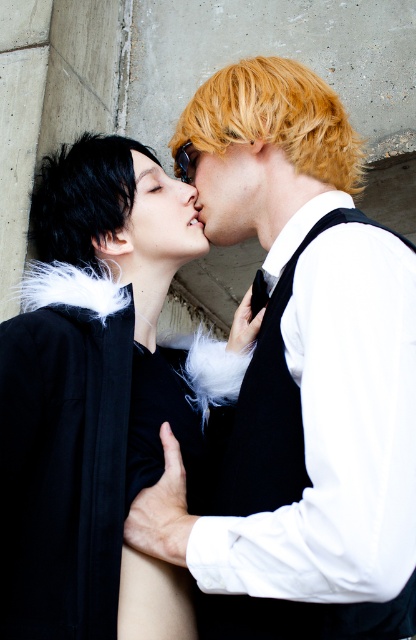
You are a photographer adjusting the focus on your camera. You notice two points in the image labeled as point (24, 422) and point (170, 144). Which point should you focus on to ensure it appears sharp in the final photo?

You should focus on point (24, 422) because it is closer to the camera than point (170, 144), making it the foreground element that requires clear focus.

You are a makeup artist preparing for a photoshoot. You need to choose between the smooth blonde wig at center and the blonde hair at center for a character that requires a taller hairstyle. Which option should you select?

The smooth blonde wig at center is much taller than the blonde hair at center, so you should select the smooth blonde wig at center for the character that requires a taller hairstyle.